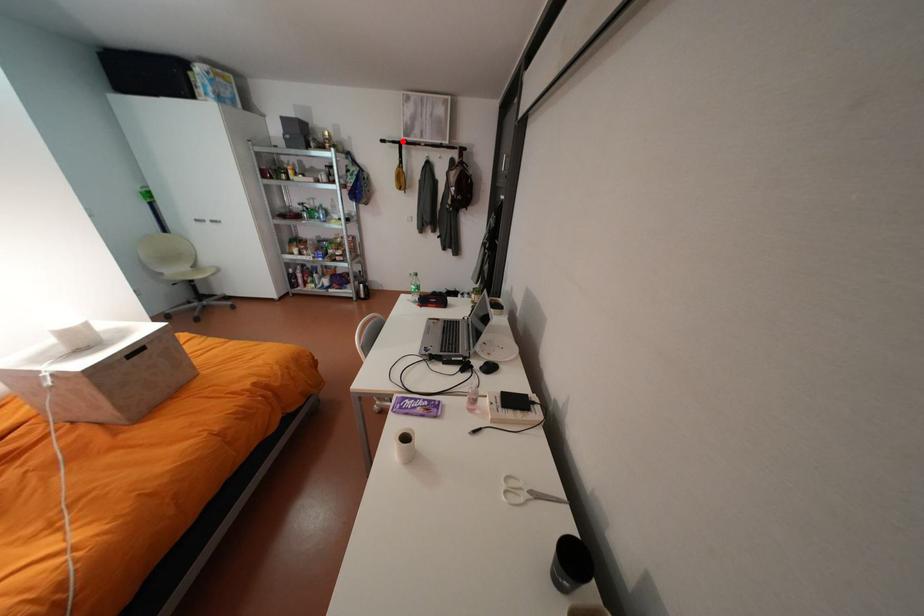
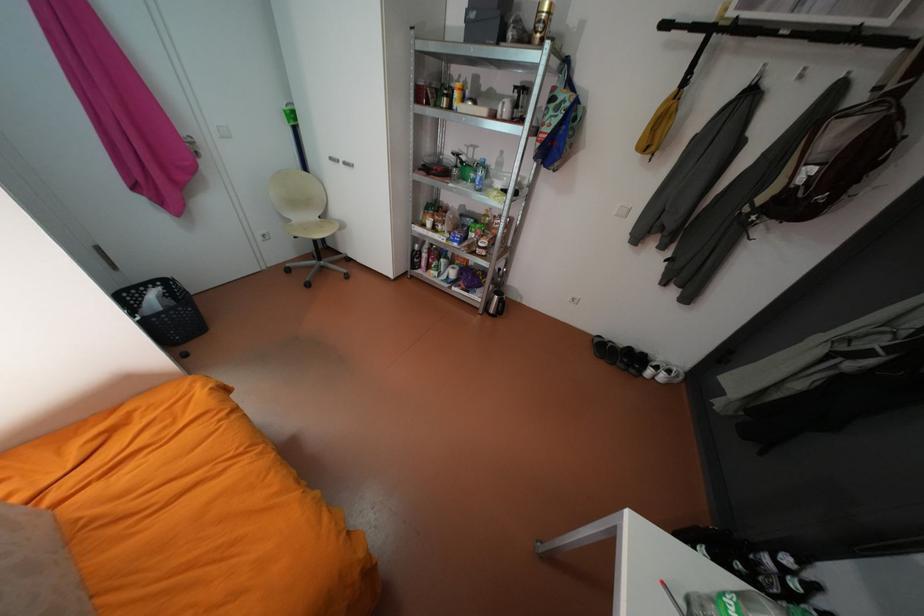
In the second image, find the point that corresponds to the highlighted location in the first image.

(703, 26)